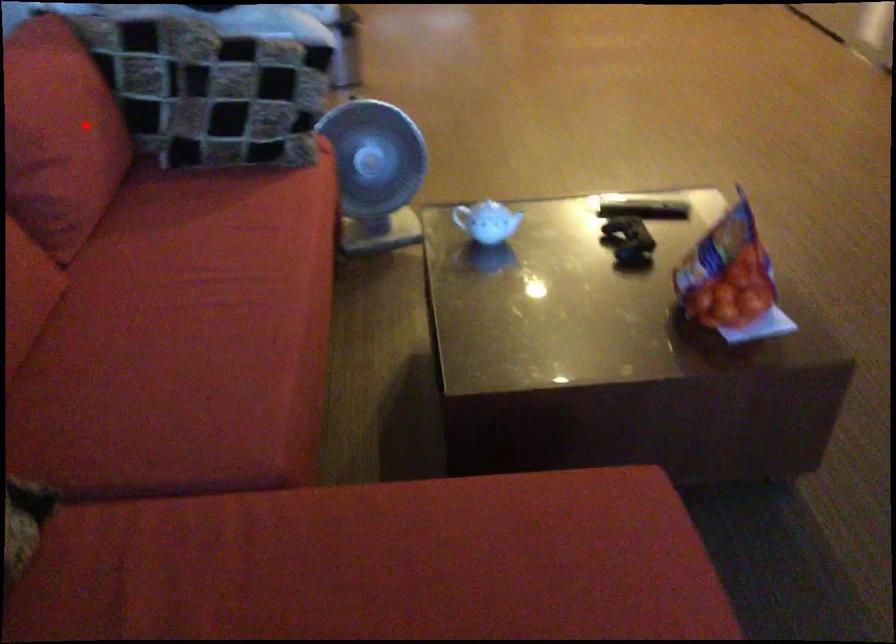
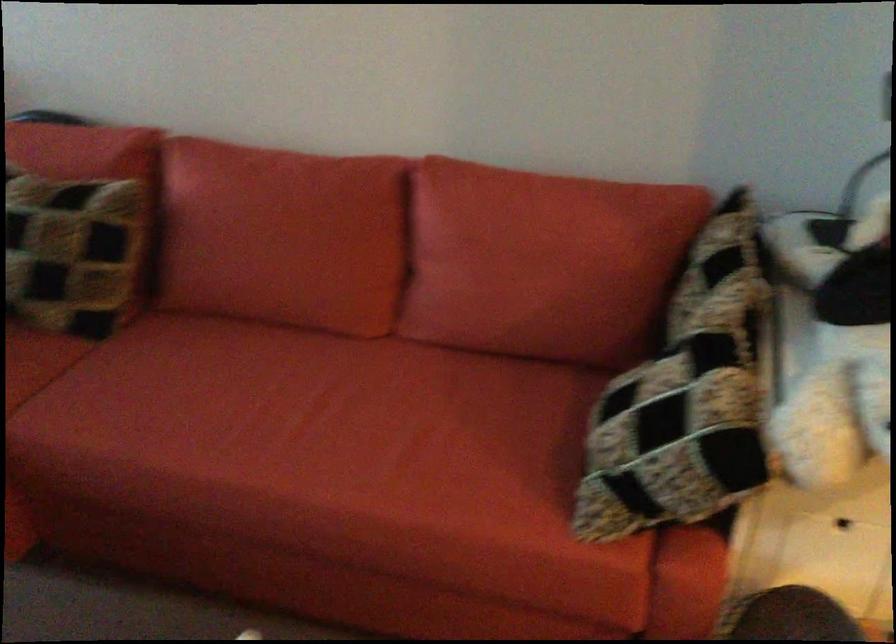
Question: I am providing you with two images of the same scene from different viewpoints. Image1 has a red point marked. In image2, the corresponding 3D location appears at what relative position? Reply with the corresponding letter.

Choices:
 (A) Closer
 (B) Farther

Answer: (A)